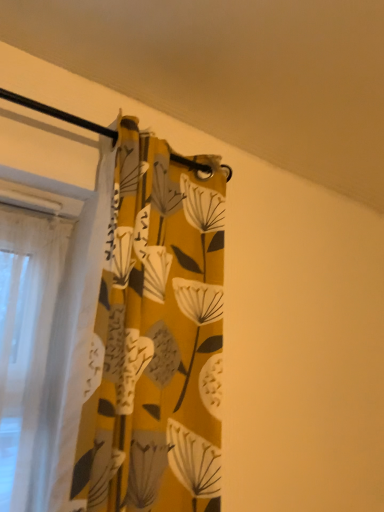
Question: Considering the positions of yellow fabric at upper left and yellow fabric curtain at left in the image, is yellow fabric at upper left taller or shorter than yellow fabric curtain at left?

Choices:
 (A) tall
 (B) short

Answer: (B)

Question: From the image's perspective, is yellow fabric at upper left above or below yellow fabric curtain at left?

Choices:
 (A) above
 (B) below

Answer: (A)

Question: Is yellow fabric at upper left inside the boundaries of yellow fabric curtain at left, or outside?

Choices:
 (A) outside
 (B) inside

Answer: (A)

Question: Looking at the image, does yellow fabric curtain at left seem bigger or smaller compared to yellow fabric at upper left?

Choices:
 (A) big
 (B) small

Answer: (B)

Question: Considering their positions, is yellow fabric curtain at left located in front of or behind yellow fabric at upper left?

Choices:
 (A) front
 (B) behind

Answer: (B)

Question: Is point pos(173,181) positioned closer to the camera than point pos(122,64)?

Choices:
 (A) closer
 (B) farther

Answer: (B)

Question: Is yellow fabric curtain at left taller or shorter than yellow fabric at upper left?

Choices:
 (A) short
 (B) tall

Answer: (B)